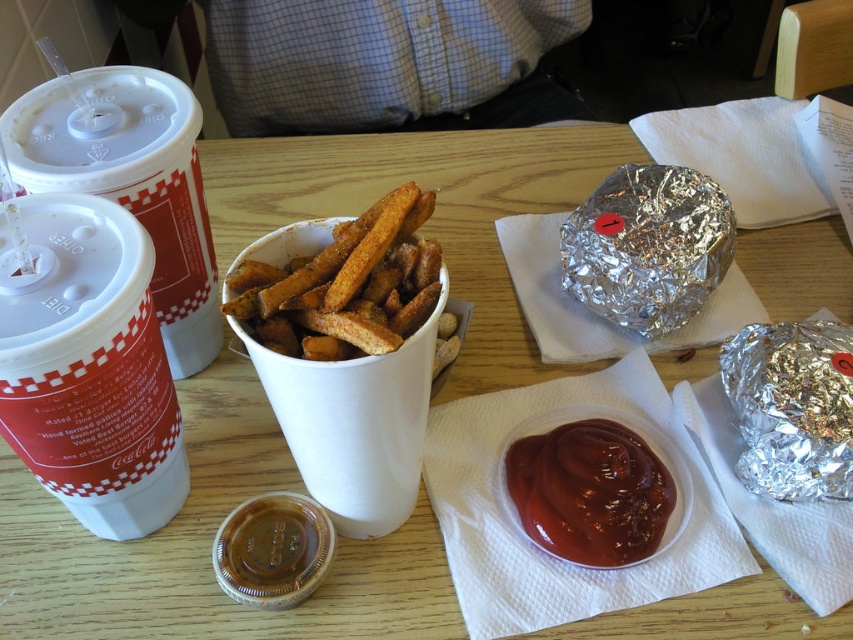
You are trying to reach for the golden crispy french fries at center from where you are sitting. There is a white paper cup at left in the way. Can you grab the fries without moving the cup?

The white paper cup at left and golden crispy french fries at center are 3.89 inches apart, so you can grab the fries without moving the cup since the distance between them allows enough space to reach around the cup.

Where is the white paper cup at left located in the image?

The white paper cup at left is located at point (90, 365) in the image.